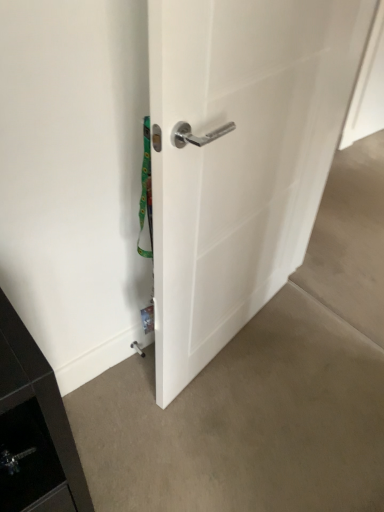
At what (x,y) coordinates should I click in order to perform the action: click on vacant area on top of light brown carpet at lower center, which appears as the 2th concrete when viewed from the top (from a real-world perspective). Please return your answer as a coordinate pair (x, y). This screenshot has width=384, height=512. Looking at the image, I should click on (243, 410).